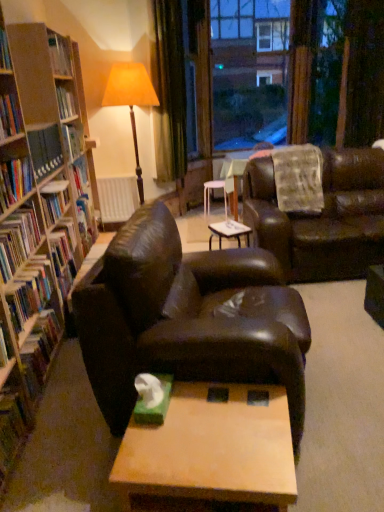
Measure the distance between green matte tissue box at center and camera.

The depth of green matte tissue box at center is 1.59 meters.

In order to face hardcover book at left, the 4th book from the top, should I rotate leftwards or rightwards?

It's best to rotate left around 24.176 degrees.

Identify the location of green velvet curtain at upper center. The image size is (384, 512). (169, 90).

Describe the element at coordinates (169, 90) in the screenshot. I see `green velvet curtain at upper center` at that location.

In order to face matte orange fabric lampshade at upper center, should I rotate leftwards or rightwards?

To align with it, rotate left about 7.666°.

Consider the image. What is the approximate height of wooden coffee table at center, placed as the second table when sorted from top to bottom?

wooden coffee table at center, placed as the second table when sorted from top to bottom, is 15.54 inches in height.

The image size is (384, 512). In order to click on hardcover book at left, the fifth book when ordered from bottom to top in this screenshot , I will do `click(14, 181)`.

Describe the element at coordinates (14, 181) in the screenshot. I see `hardcover book at left, the fifth book when ordered from bottom to top` at that location.

You are a GUI agent. You are given a task and a screenshot of the screen. Output one action in this format:
    pyautogui.click(x=<x>, y=<y>)
    Task: Click on the green matte tissue box at center
    
    Given the screenshot: What is the action you would take?
    pyautogui.click(x=154, y=407)

From a real-world perspective, starting from the green matte tissue box at center, which table is the 1st one below it? Please provide its 2D coordinates.

[(217, 188)]

Is green matte tissue box at center next to white plastic table at center, the 1th table from the top?

No, green matte tissue box at center is not touching white plastic table at center, the 1th table from the top.

From the image's perspective, who appears lower, green matte tissue box at center or white plastic table at center, the 1th table from the top?

green matte tissue box at center is shown below in the image.

Does green matte tissue box at center have a lesser height compared to white plastic table at center, which is the first table in back-to-front order?

Indeed, green matte tissue box at center has a lesser height compared to white plastic table at center, which is the first table in back-to-front order.

Is shiny brown leather couch at center, acting as the 1th studio couch starting from the front, taller or shorter than hardcover book at left, marked as the 1th book in a top-to-bottom arrangement?

In the image, shiny brown leather couch at center, acting as the 1th studio couch starting from the front, appears to be taller than hardcover book at left, marked as the 1th book in a top-to-bottom arrangement.

How much distance is there between shiny brown leather couch at center, the 2th studio couch from the right, and hardcover book at left, marked as the seventh book in a bottom-to-top arrangement?

1.26 meters.

Is shiny brown leather couch at center, acting as the 1th studio couch starting from the left, in contact with hardcover book at left, marked as the seventh book in a bottom-to-top arrangement?

shiny brown leather couch at center, acting as the 1th studio couch starting from the left, and hardcover book at left, marked as the seventh book in a bottom-to-top arrangement, are clearly separated.

Between wooden coffee table at center, which is counted as the first table, starting from the front, and hardcover book at left, which appears as the 3th book when ordered from the bottom, which one has smaller width?

With smaller width is hardcover book at left, which appears as the 3th book when ordered from the bottom.

Can you confirm if wooden coffee table at center, which is counted as the first table, starting from the front, is taller than hardcover book at left, which is the fifth book in top-to-bottom order?

Yes.

Choose the correct answer: Is wooden coffee table at center, which is the first table in bottom-to-top order, inside hardcover book at left, which is the fifth book in top-to-bottom order, or outside it?

wooden coffee table at center, which is the first table in bottom-to-top order, is outside hardcover book at left, which is the fifth book in top-to-bottom order.

Visually, is wooden coffee table at center, acting as the second table starting from the back, positioned to the left or to the right of hardcover book at left, which appears as the 3th book when ordered from the bottom?

Based on their positions, wooden coffee table at center, acting as the second table starting from the back, is located to the right of hardcover book at left, which appears as the 3th book when ordered from the bottom.

Considering the sizes of green matte book at left, which is the first book from bottom to top, and hardcover book at left, the 6th book in the bottom-to-top sequence, in the image, is green matte book at left, which is the first book from bottom to top, taller or shorter than hardcover book at left, the 6th book in the bottom-to-top sequence,?

Clearly, green matte book at left, which is the first book from bottom to top, is shorter compared to hardcover book at left, the 6th book in the bottom-to-top sequence.

From a real-world perspective, is green matte book at left, which is the first book from bottom to top, over hardcover book at left, which ranks as the 2th book in top-to-bottom order?

No, from a real-world perspective, green matte book at left, which is the first book from bottom to top, is not over hardcover book at left, which ranks as the 2th book in top-to-bottom order

Can you confirm if green matte book at left, acting as the seventh book starting from the top, is smaller than hardcover book at left, the 6th book in the bottom-to-top sequence?

Actually, green matte book at left, acting as the seventh book starting from the top, might be larger than hardcover book at left, the 6th book in the bottom-to-top sequence.

The image size is (384, 512). What are the coordinates of `book that is the 5th object located above the green matte book at left, acting as the seventh book starting from the top (from the image's perspective)` in the screenshot? It's located at (10, 116).

In order to click on paperback book in front of the hardcover book at left, which appears as the 3th book when ordered from the bottom in this screenshot , I will do `click(154, 407)`.

Does hardcover book at left, which is the fifth book in top-to-bottom order, lie in front of green matte tissue box at center?

That is False.

Is hardcover book at left, which is the fifth book in top-to-bottom order, in contact with green matte tissue box at center?

No, hardcover book at left, which is the fifth book in top-to-bottom order, is not beside green matte tissue box at center.

Is point (27, 310) positioned behind point (159, 378)?

Yes.

Considering their positions, is hardcover book at left, which is the fifth book in top-to-bottom order, located in front of or behind hardcover book at left, which ranks as the 6th book in top-to-bottom order?

Visually, hardcover book at left, which is the fifth book in top-to-bottom order, is located in front of hardcover book at left, which ranks as the 6th book in top-to-bottom order.

This screenshot has height=512, width=384. In order to click on the 1st book in front of the hardcover book at left, which ranks as the 6th book in top-to-bottom order in this screenshot , I will do `click(30, 291)`.

Is hardcover book at left, which appears as the 3th book when ordered from the bottom, positioned far away from hardcover book at left, which ranks as the 6th book in top-to-bottom order?

That's not correct — hardcover book at left, which appears as the 3th book when ordered from the bottom, is a little close to hardcover book at left, which ranks as the 6th book in top-to-bottom order.

Does point (44, 297) come closer to viewer compared to point (33, 364)?

No, it is not.

Between hardcover book at left, the 6th book in the bottom-to-top sequence, and hardcover book at left, marked as the 1th book in a top-to-bottom arrangement, which one has larger size?

With larger size is hardcover book at left, marked as the 1th book in a top-to-bottom arrangement.

Considering the sizes of hardcover book at left, the 6th book in the bottom-to-top sequence, and hardcover book at left, marked as the seventh book in a bottom-to-top arrangement, in the image, is hardcover book at left, the 6th book in the bottom-to-top sequence, wider or thinner than hardcover book at left, marked as the seventh book in a bottom-to-top arrangement,?

hardcover book at left, the 6th book in the bottom-to-top sequence, is thinner than hardcover book at left, marked as the seventh book in a bottom-to-top arrangement.

From the image's perspective, which is above, hardcover book at left, the 6th book in the bottom-to-top sequence, or hardcover book at left, marked as the 1th book in a top-to-bottom arrangement?

hardcover book at left, marked as the 1th book in a top-to-bottom arrangement, from the image's perspective.

Which of these two, hardcover book at left, the 6th book in the bottom-to-top sequence, or hardcover book at left, marked as the 1th book in a top-to-bottom arrangement, stands shorter?

hardcover book at left, the 6th book in the bottom-to-top sequence.

Locate an element on the screen. paperback book in front of the white plastic table at center, the 2th table when ordered from bottom to top is located at coordinates (154, 407).

The image size is (384, 512). I want to click on the 1st studio couch to the right of the hardcover book at left, marked as the 1th book in a top-to-bottom arrangement, counting from the anchor's position, so click(x=187, y=318).

Based on their spatial positions, is transparent glass window at upper center or white matte radiator at center closer to wooden coffee table at center, acting as the second table starting from the back?

white matte radiator at center is closer to wooden coffee table at center, acting as the second table starting from the back.

Considering their positions, is transparent glass window at upper center positioned closer to matte orange fabric lampshade at upper center than hardcover book at left, marked as the 1th book in a top-to-bottom arrangement?

hardcover book at left, marked as the 1th book in a top-to-bottom arrangement, is closer to matte orange fabric lampshade at upper center.

Considering their positions, is white matte radiator at center positioned closer to transparent glass window at upper center than hardcover book at left, marked as the 1th book in a top-to-bottom arrangement?

The object closer to transparent glass window at upper center is white matte radiator at center.

Which object lies further to the anchor point leather couch at center, which is counted as the second studio couch, starting from the front, white matte radiator at center or white plastic table at center, acting as the 2th table starting from the front?

white matte radiator at center is further to leather couch at center, which is counted as the second studio couch, starting from the front.

When comparing their distances from hardcover book at left, the 4th book from the bottom, does hardcover book at left, the fifth book when ordered from bottom to top, or shiny brown leather couch at center, which is the 2th studio couch from back to front, seem closer?

hardcover book at left, the fifth book when ordered from bottom to top, lies closer to hardcover book at left, the 4th book from the bottom, than the other object.

Estimate the real-world distances between objects in this image. Which object is further from green velvet curtain at upper center, green matte tissue box at center or hardcover book at left, marked as the 1th book in a top-to-bottom arrangement?

Among the two, green matte tissue box at center is located further to green velvet curtain at upper center.

Which object lies nearer to the anchor point matte orange fabric lampshade at upper center, transparent glass window at upper center or green matte tissue box at center?

transparent glass window at upper center is closer to matte orange fabric lampshade at upper center.

Which object lies nearer to the anchor point shiny brown leather couch at center, which is the 2th studio couch from back to front, hardcover book at left, which appears as the 3th book when ordered from the bottom, or transparent glass window at upper center?

The object closer to shiny brown leather couch at center, which is the 2th studio couch from back to front, is hardcover book at left, which appears as the 3th book when ordered from the bottom.

Find the location of a particular element. The height and width of the screenshot is (512, 384). table lamp between wooden coffee table at center, which is the first table in bottom-to-top order, and transparent glass window at upper center in the front-back direction is located at coordinates (131, 100).

What are the coordinates of `studio couch positioned between green matte book at left, acting as the seventh book starting from the top, and transparent glass window at upper center from near to far` in the screenshot? It's located at pos(322,218).

Image resolution: width=384 pixels, height=512 pixels. In order to click on table positioned between hardcover book at left, the third book from the top, and transparent glass window at upper center from near to far in this screenshot , I will do `click(217, 188)`.

Identify the location of table between hardcover book at left, which appears as the 3th book when ordered from the bottom, and shiny brown leather couch at center, the 2th studio couch from the right, from left to right. This screenshot has width=384, height=512. (211, 452).